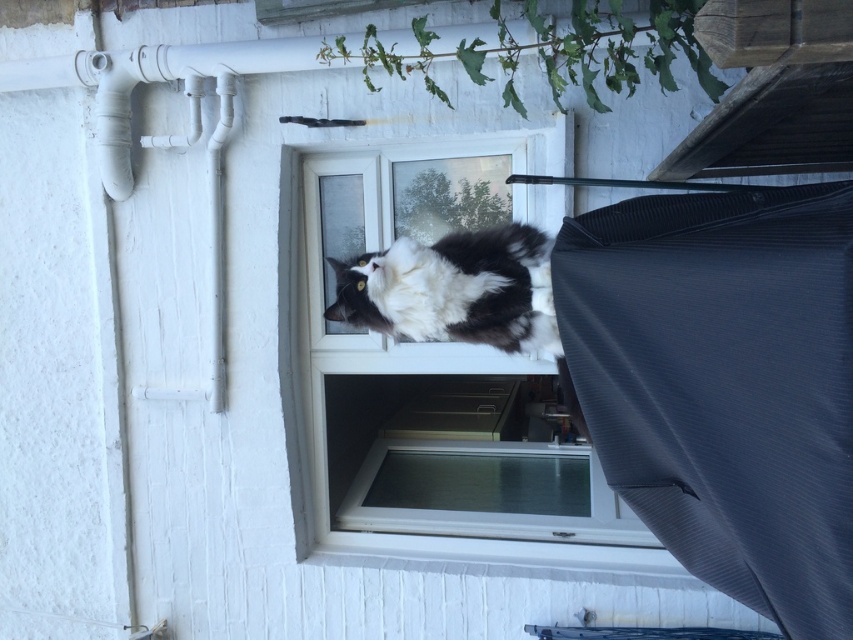
Can you confirm if clear glass window at center is smaller than white painted wood at lower center?

No.

Is point (485, 413) closer to camera compared to point (671, 564)?

No, (485, 413) is further to viewer.

The width and height of the screenshot is (853, 640). Find the location of `clear glass window at center`. clear glass window at center is located at coordinates (439, 374).

Is point (318, 326) farther from viewer compared to point (426, 337)?

Yes, point (318, 326) is behind point (426, 337).

How distant is clear glass window at center from black and white fur cat at center?

The distance of clear glass window at center from black and white fur cat at center is 5.02 feet.

Is point (514, 502) positioned behind point (456, 316)?

Yes, it is.

Identify the location of clear glass window at center. (439, 374).

Can you confirm if dark grey textured fabric at right is bigger than black and white fur cat at center?

Correct, dark grey textured fabric at right is larger in size than black and white fur cat at center.

Identify the location of dark grey textured fabric at right. (723, 385).